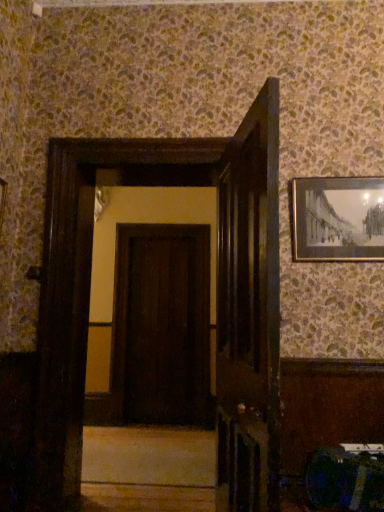
Question: Is dark wood door at center, the second door in the left-to-right sequence, turned away from dark brown wood door at center, marked as the second door in a right-to-left arrangement?

Choices:
 (A) yes
 (B) no

Answer: (B)

Question: Is dark brown wood door at center, acting as the first door starting from the back, inside dark wood door at center, the second door in the left-to-right sequence?

Choices:
 (A) yes
 (B) no

Answer: (B)

Question: Does dark wood door at center, the second door in the left-to-right sequence, have a greater height compared to dark brown wood door at center, acting as the first door starting from the back?

Choices:
 (A) yes
 (B) no

Answer: (B)

Question: Is the depth of dark wood door at center, which is the first door from right to left, greater than that of dark brown wood door at center, marked as the second door in a right-to-left arrangement?

Choices:
 (A) yes
 (B) no

Answer: (B)

Question: From a real-world perspective, is dark wood door at center, marked as the second door in a back-to-front arrangement, physically below dark brown wood door at center, placed as the 1th door when sorted from left to right?

Choices:
 (A) yes
 (B) no

Answer: (A)

Question: Is dark wood door at center, marked as the second door in a back-to-front arrangement, thinner than dark brown wood door at center, marked as the second door in a right-to-left arrangement?

Choices:
 (A) no
 (B) yes

Answer: (A)

Question: Is gold-framed picture at upper right positioned in front of smooth beige stair at center?

Choices:
 (A) no
 (B) yes

Answer: (B)

Question: Is gold-framed picture at upper right further to the viewer compared to smooth beige stair at center?

Choices:
 (A) no
 (B) yes

Answer: (A)

Question: Considering the relative sizes of gold-framed picture at upper right and smooth beige stair at center in the image provided, is gold-framed picture at upper right wider than smooth beige stair at center?

Choices:
 (A) yes
 (B) no

Answer: (B)

Question: Is gold-framed picture at upper right outside of smooth beige stair at center?

Choices:
 (A) yes
 (B) no

Answer: (A)

Question: Can you confirm if gold-framed picture at upper right is taller than smooth beige stair at center?

Choices:
 (A) yes
 (B) no

Answer: (A)

Question: Is gold-framed picture at upper right to the left of smooth beige stair at center from the viewer's perspective?

Choices:
 (A) no
 (B) yes

Answer: (A)

Question: Does dark brown wood door at center, acting as the first door starting from the back, have a smaller size compared to gold-framed picture at upper right?

Choices:
 (A) yes
 (B) no

Answer: (B)